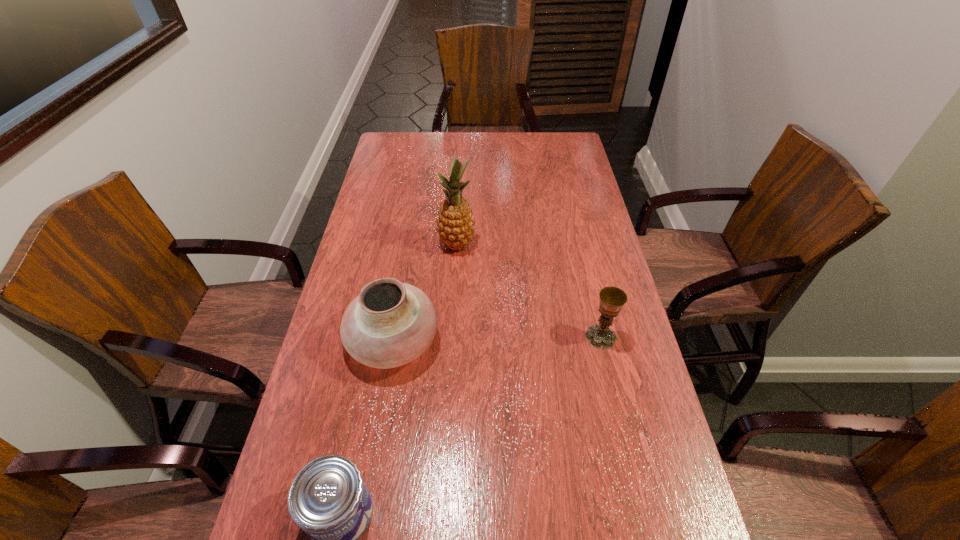
I want to click on the tallest object, so click(x=455, y=224).

Image resolution: width=960 pixels, height=540 pixels. In order to click on the farthest object in this screenshot , I will do `click(455, 224)`.

Image resolution: width=960 pixels, height=540 pixels. Find the location of `pottery`. pottery is located at coordinates (389, 324).

This screenshot has height=540, width=960. What are the coordinates of `chalice` in the screenshot? It's located at (612, 299).

Where is `the rightmost object`? the rightmost object is located at coordinates (612, 299).

Where is `free point located on the back of the farthest object`? free point located on the back of the farthest object is located at coordinates (460, 197).

This screenshot has width=960, height=540. In order to click on vacant space situated on the right of the pottery in this screenshot , I will do `click(498, 341)`.

At what (x,y) coordinates should I click in order to perform the action: click on free spot located on the back of the second shortest object. Please return your answer as a coordinate pair (x, y). Looking at the image, I should click on (594, 311).

Where is `object located in the left edge section of the desktop`? object located in the left edge section of the desktop is located at coordinates (389, 324).

At what (x,y) coordinates should I click in order to perform the action: click on object positioned at the right edge. Please return your answer as a coordinate pair (x, y). Looking at the image, I should click on (612, 299).